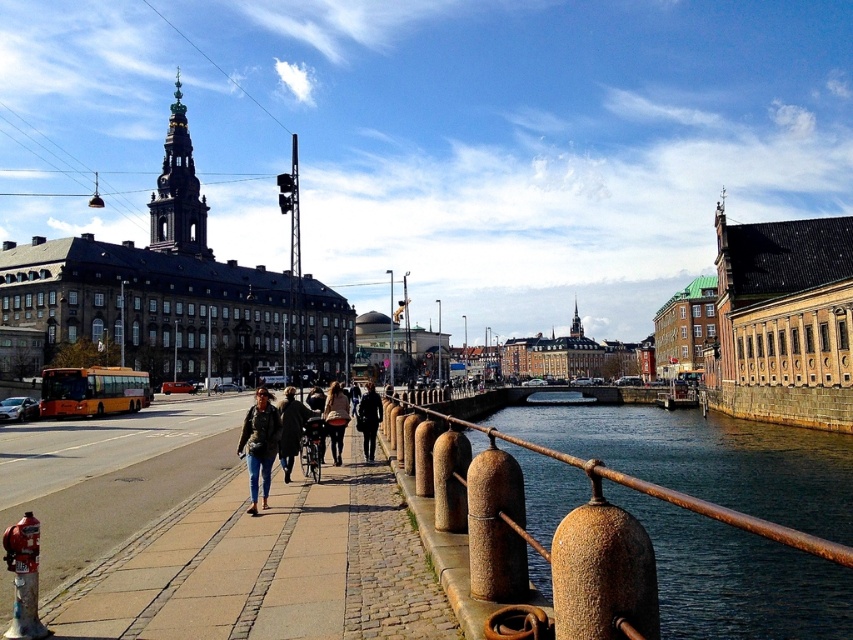
Question: Estimate the real-world distances between objects in this image. Which object is farther from the rusty metal water at lower center?

Choices:
 (A) leather jacket at center
 (B) denim jacket at center
 (C) red metallic fire hydrant at lower left
 (D) dark blue jeans at center

Answer: (C)

Question: Among these objects, which one is farthest from the camera?

Choices:
 (A) denim jacket at center
 (B) dark blue jeans at center
 (C) dark brown leather jacket at center

Answer: (B)

Question: Does leather jacket at center lie in front of dark blue jeans at center?

Choices:
 (A) no
 (B) yes

Answer: (B)

Question: Which of these objects is positioned closest to the red metallic fire hydrant at lower left?

Choices:
 (A) leather jacket at center
 (B) rusty metal water at lower center
 (C) dark blue jeans at center
 (D) cobblestone sidewalk at center

Answer: (D)

Question: Can you confirm if red metallic fire hydrant at lower left is positioned to the left of denim jacket at center?

Choices:
 (A) yes
 (B) no

Answer: (B)

Question: Does red metallic fire hydrant at lower left appear under dark blue jeans at center?

Choices:
 (A) no
 (B) yes

Answer: (B)